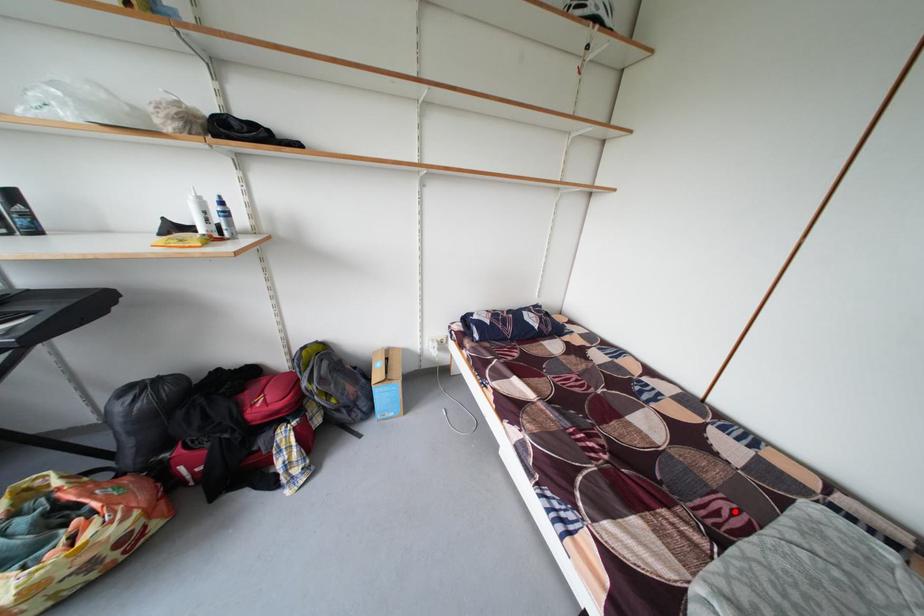
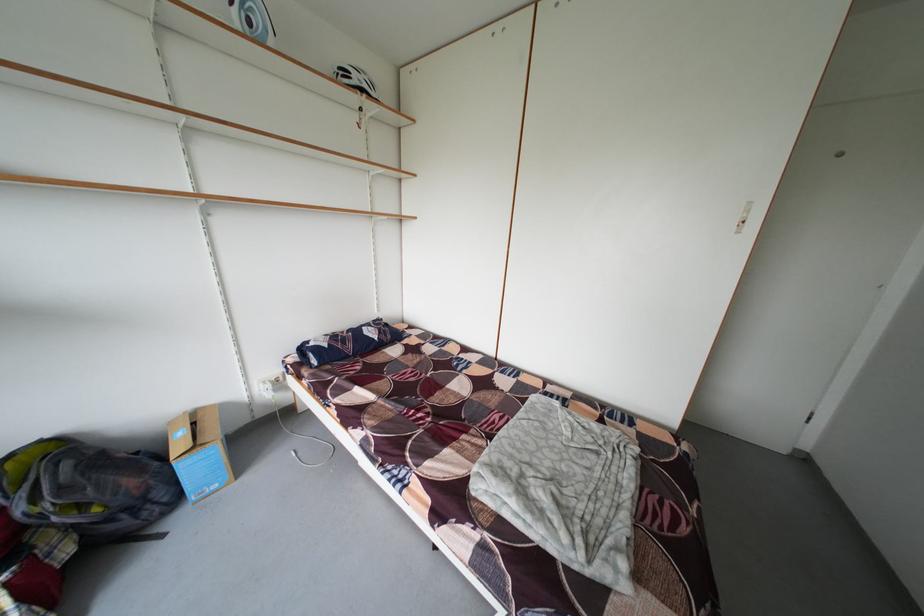
The point at the highlighted location is marked in the first image. Where is the corresponding point in the second image?

(506, 422)